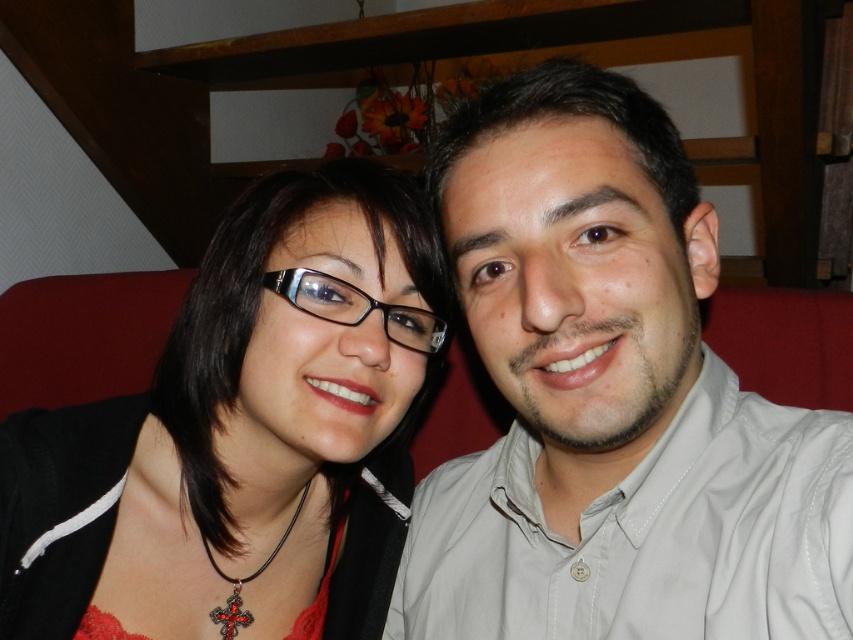
From the picture: Between light beige shirt at center and transparent plastic glasses at center, which one appears on the left side from the viewer's perspective?

transparent plastic glasses at center is more to the left.

Who is higher up, light beige shirt at center or transparent plastic glasses at center?

transparent plastic glasses at center

Between point (566, 168) and point (310, 310), which one is positioned in front?

Positioned in front is point (566, 168).

At what (x,y) coordinates should I click in order to perform the action: click on light beige shirt at center. Please return your answer as a coordinate pair (x, y). Image resolution: width=853 pixels, height=640 pixels. Looking at the image, I should click on (611, 400).

Looking at this image, between light beige shirt at center and matte black glasses at center, which one has more height?

Standing taller between the two is light beige shirt at center.

Who is lower down, light beige shirt at center or matte black glasses at center?

light beige shirt at center is lower down.

You are a GUI agent. You are given a task and a screenshot of the screen. Output one action in this format:
    pyautogui.click(x=<x>, y=<y>)
    Task: Click on the light beige shirt at center
    Image resolution: width=853 pixels, height=640 pixels.
    Given the screenshot: What is the action you would take?
    pyautogui.click(x=611, y=400)

Which is behind, point (93, 518) or point (355, 291)?

The point (93, 518) is more distant.

Can you confirm if matte black glasses at center is smaller than transparent plastic glasses at center?

Actually, matte black glasses at center might be larger than transparent plastic glasses at center.

Between point (368, 516) and point (335, 296), which one is positioned behind?

Positioned behind is point (368, 516).

I want to click on matte black glasses at center, so click(x=242, y=435).